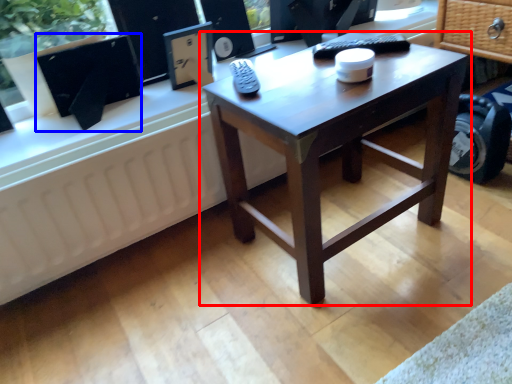
Question: Which object is further to the camera taking this photo, coffee table (highlighted by a red box) or computer monitor (highlighted by a blue box)?

Choices:
 (A) coffee table
 (B) computer monitor

Answer: (B)